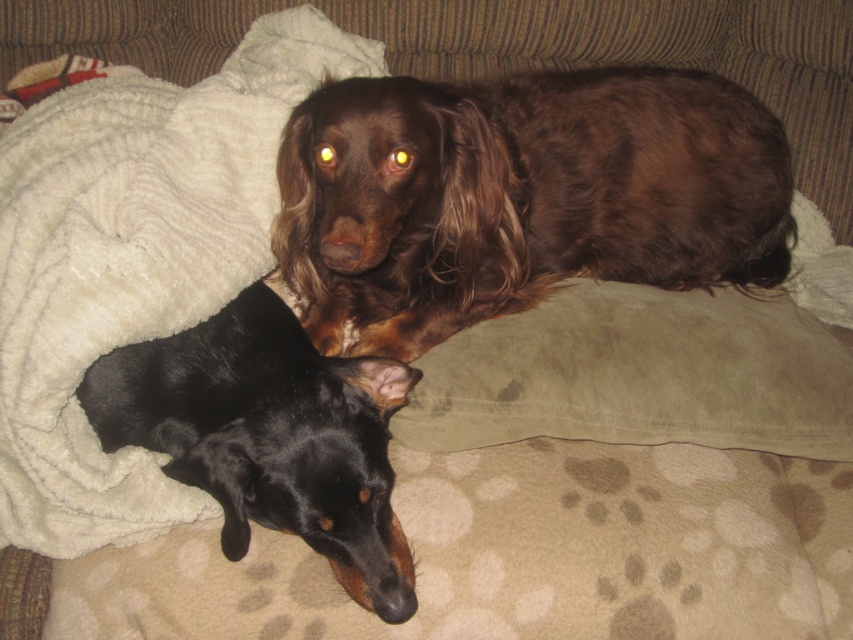
Question: Which object is farther from the camera taking this photo?

Choices:
 (A) black smooth dog at lower left
 (B) suede-like brown pillow at upper right

Answer: (B)

Question: Which point is farther to the camera?

Choices:
 (A) (547, 392)
 (B) (715, 230)
 (C) (132, 282)
 (D) (384, 472)

Answer: (B)

Question: Among these objects, which one is nearest to the camera?

Choices:
 (A) brown furry dog at upper center
 (B) black smooth dog at lower left
 (C) white fluffy blanket at lower left
 (D) suede-like brown pillow at upper right

Answer: (C)

Question: Can you confirm if white fluffy blanket at lower left is wider than suede-like brown pillow at upper right?

Choices:
 (A) yes
 (B) no

Answer: (B)

Question: Can you confirm if white fluffy blanket at lower left is wider than black smooth dog at lower left?

Choices:
 (A) no
 (B) yes

Answer: (B)

Question: Can you confirm if brown furry dog at upper center is positioned above white fluffy blanket at lower left?

Choices:
 (A) no
 (B) yes

Answer: (B)